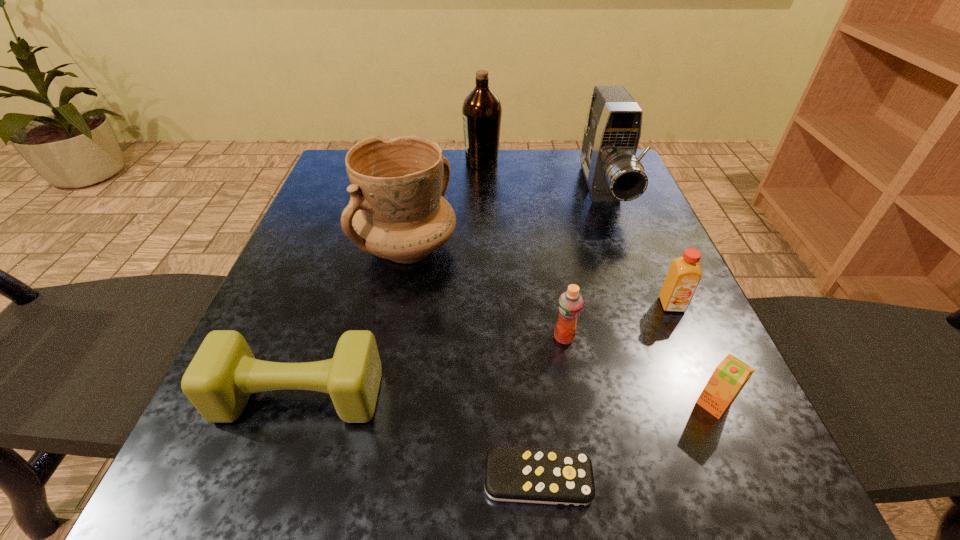
This screenshot has width=960, height=540. In order to click on olive oil in this screenshot , I will do `click(482, 110)`.

Image resolution: width=960 pixels, height=540 pixels. What are the coordinates of `camcorder` in the screenshot? It's located at (613, 173).

This screenshot has width=960, height=540. I want to click on pottery, so click(x=397, y=211).

What are the coordinates of `the fourth farthest object` in the screenshot? It's located at (685, 273).

Where is `the leftmost orange juice`? The image size is (960, 540). the leftmost orange juice is located at coordinates (570, 304).

You are a GUI agent. You are given a task and a screenshot of the screen. Output one action in this format:
    pyautogui.click(x=<x>, y=<y>)
    Task: Click on the second nearest orange juice
    
    Given the screenshot: What is the action you would take?
    pyautogui.click(x=570, y=304)

Find the location of a particular element. This screenshot has height=540, width=960. dumbbell is located at coordinates (223, 374).

At what (x,y) coordinates should I click in order to perform the action: click on the shortest orange juice. Please return your answer as a coordinate pair (x, y). This screenshot has height=540, width=960. Looking at the image, I should click on (728, 379).

What are the coordinates of `the nearest object` in the screenshot? It's located at (563, 477).

Locate an element on the screen. The width and height of the screenshot is (960, 540). the shortest object is located at coordinates (563, 477).